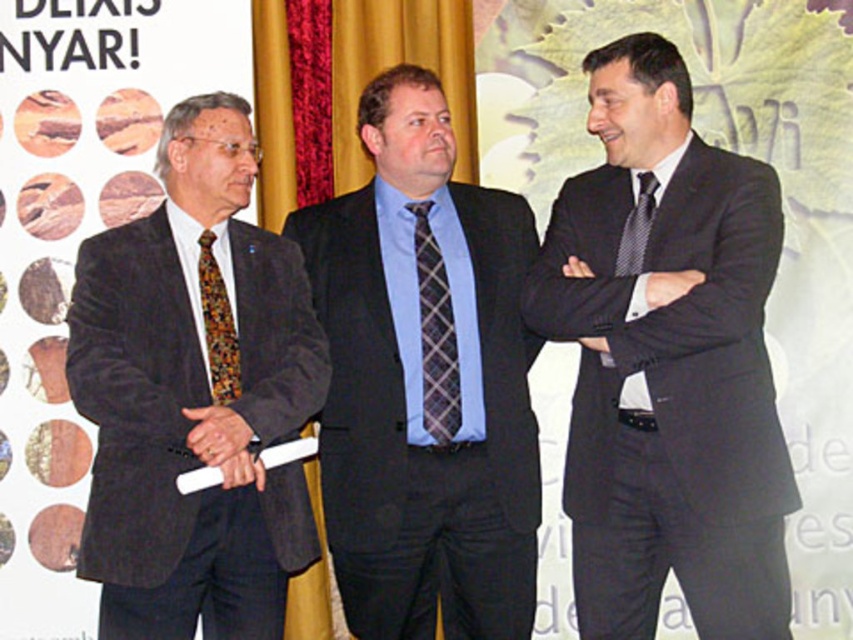
I want to click on white leather hand at center, so (x=669, y=285).

Is point (670, 276) positioned after point (582, 269)?

No.

Who is more distant from viewer, (x=674, y=273) or (x=584, y=266)?

Positioned behind is point (x=584, y=266).

Find the location of a particular element. Image resolution: width=853 pixels, height=640 pixels. white leather hand at center is located at coordinates (669, 285).

Who is higher up, matte black hand at center or white leather hand at center?

white leather hand at center is above.

Which of these two, matte black hand at center or white leather hand at center, stands taller?

Standing taller between the two is matte black hand at center.

Who is more distant from viewer, (236, 417) or (693, 280)?

The point (693, 280) is more distant.

Where is `matte black hand at center`? matte black hand at center is located at coordinates (218, 436).

Is black silk suit at center below dark gray suit at center?

Actually, black silk suit at center is above dark gray suit at center.

Find the location of a particular element. The height and width of the screenshot is (640, 853). black silk suit at center is located at coordinates (666, 364).